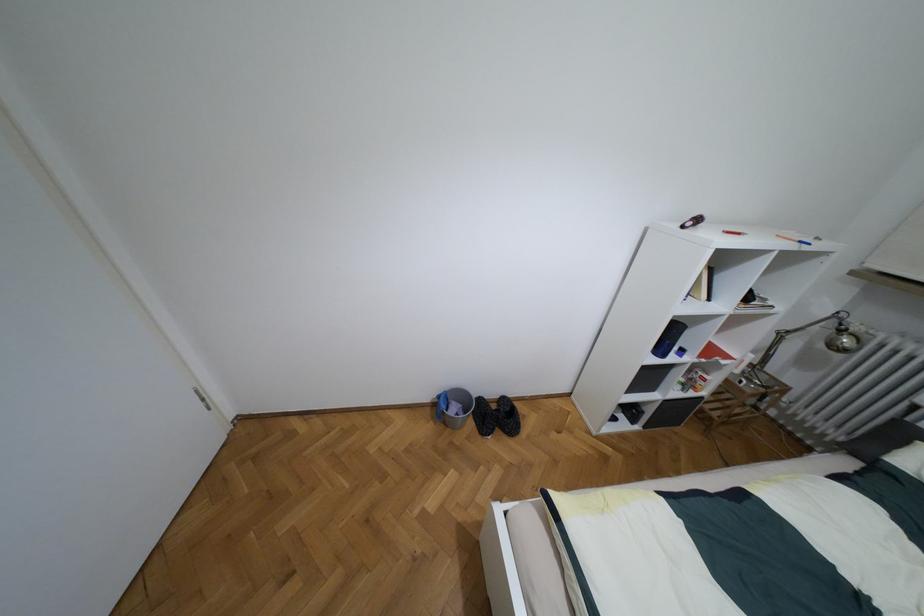
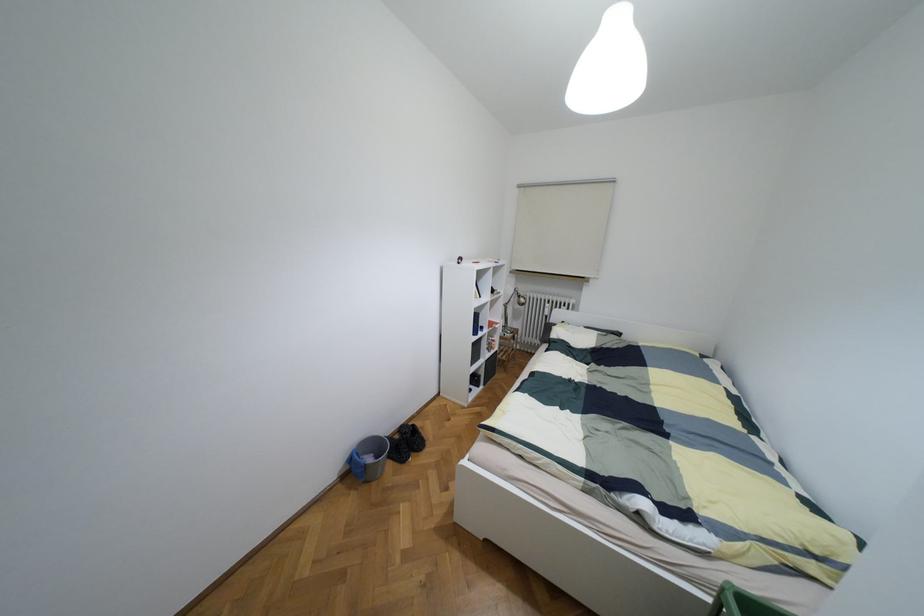
Where in the second image is the point corresponding to (453,408) from the first image?

(369, 459)